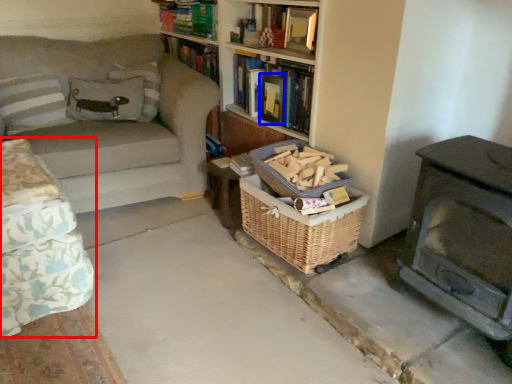
Question: Which object is closer to the camera taking this photo, studio couch (highlighted by a red box) or paperback book (highlighted by a blue box)?

Choices:
 (A) studio couch
 (B) paperback book

Answer: (A)